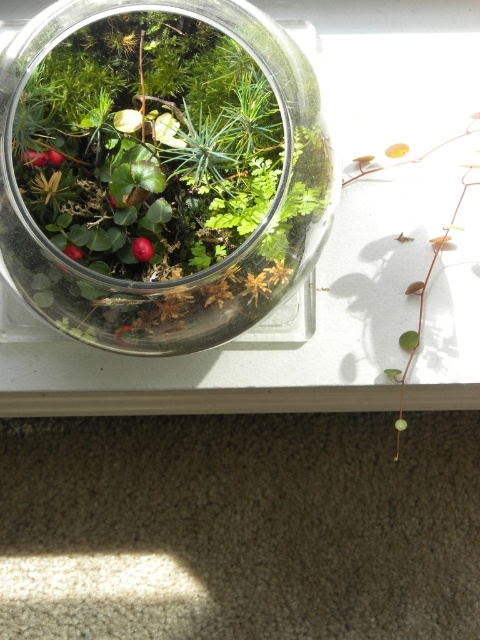
You are a gardener who wants to place a new plant between the transparent glass terrarium at center and the green glossy leaf at center. Can you fit it there?

The transparent glass terrarium at center might be wider than green glossy leaf at center, so there may not be enough space to fit a new plant between them.

You are a gardener who needs to water both the transparent glass terrarium at center and the green glossy leaf at center. The watering can you have is 3 inches in length. Can you water both without moving the can? Explain your reasoning.

The distance between the transparent glass terrarium at center and the green glossy leaf at center is 3.50 inches. Since the watering can is only 3 inches long, it is 0.50 inches shorter than needed. Therefore, you cannot reach both without moving the can.

You are a small insect trying to reach the red berries inside the transparent glass terrarium at center. Can you crawl through the opening at point [195,273] to get inside?

The point [195,273] is where the transparent glass terrarium at center is located, so the opening at that point is part of the terrarium. Since the terrarium is made of transparent glass, the insect can crawl through the opening at point [195,273] to get inside.